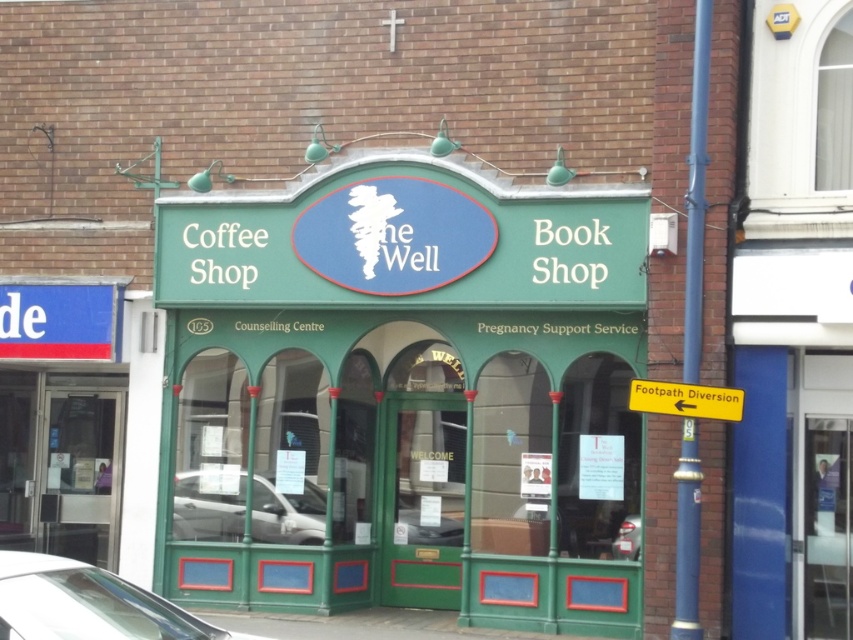
Question: Is white glossy car at lower left bigger than yellow plastic sign at right?

Choices:
 (A) no
 (B) yes

Answer: (B)

Question: Which of these objects is positioned farthest from the yellow plastic sign at right?

Choices:
 (A) green painted wood at center
 (B) silver metallic car at center
 (C) white glossy car at lower left

Answer: (C)

Question: Which is nearer to the white glossy car at lower left?

Choices:
 (A) silver metallic car at center
 (B) green painted wood at center

Answer: (A)

Question: Can you confirm if white glossy car at lower left is smaller than yellow plastic sign at right?

Choices:
 (A) no
 (B) yes

Answer: (A)

Question: Is white glossy car at lower left below silver metallic car at center?

Choices:
 (A) yes
 (B) no

Answer: (B)

Question: Which point is farther from the camera taking this photo?

Choices:
 (A) (312, 529)
 (B) (587, 541)
 (C) (730, 410)
 (D) (10, 560)

Answer: (A)